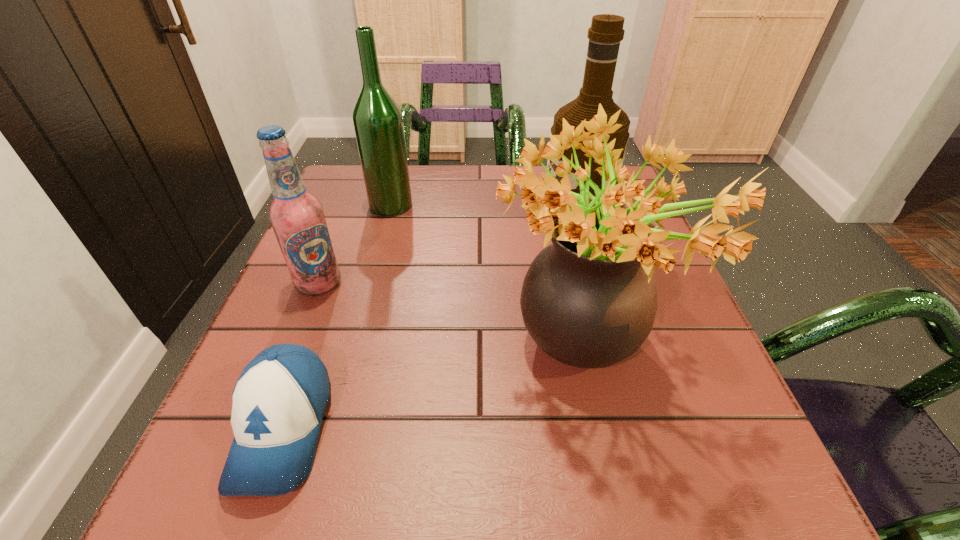
The image size is (960, 540). I want to click on free space that satisfies the following two spatial constraints: 1. on the label of the rightmost alcohol; 2. on the front side of the flower arrangement, so click(x=615, y=355).